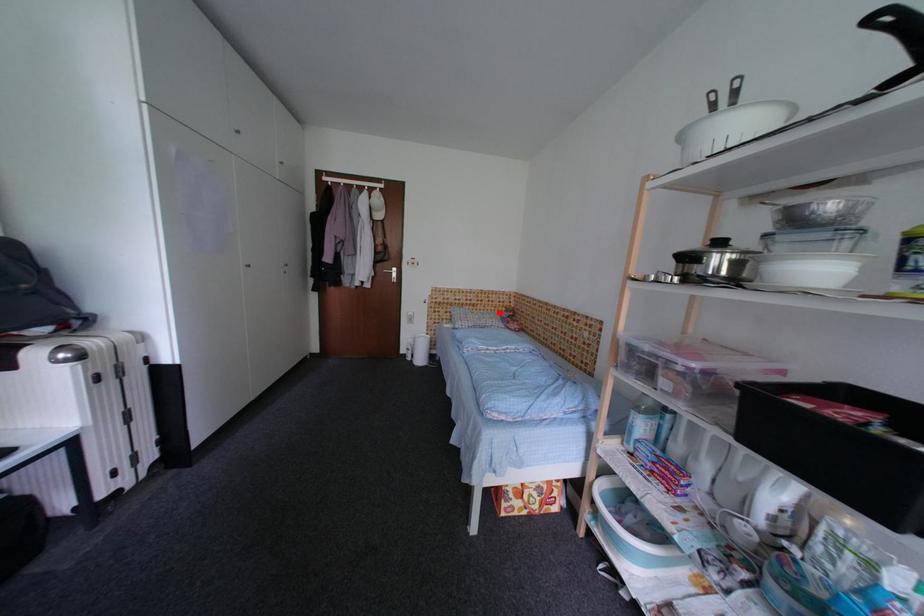
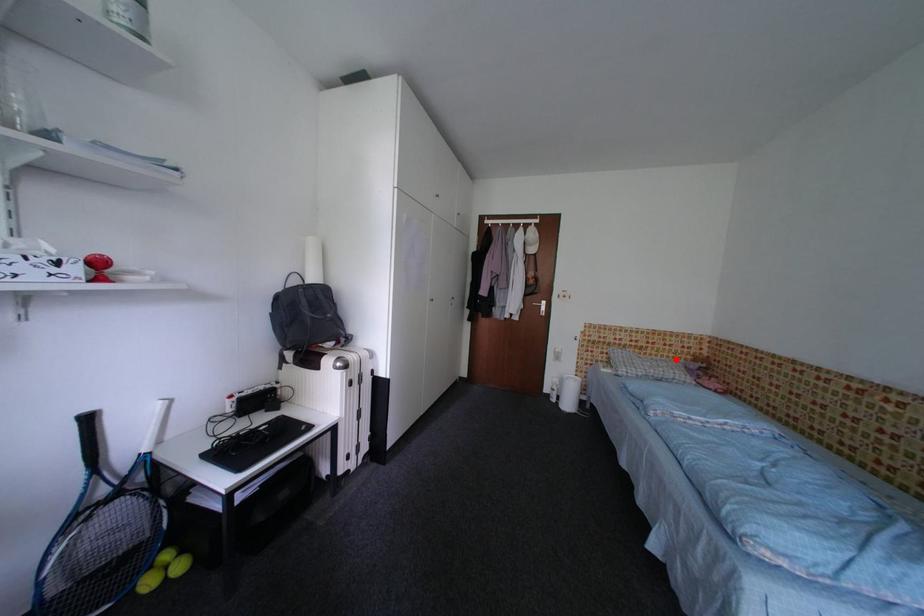
I am providing you with two images of the same scene from different viewpoints. A red point is marked on the first image and another point is marked on the second image. Are the points marked in image1 and image2 representing the same 3D position?

Yes